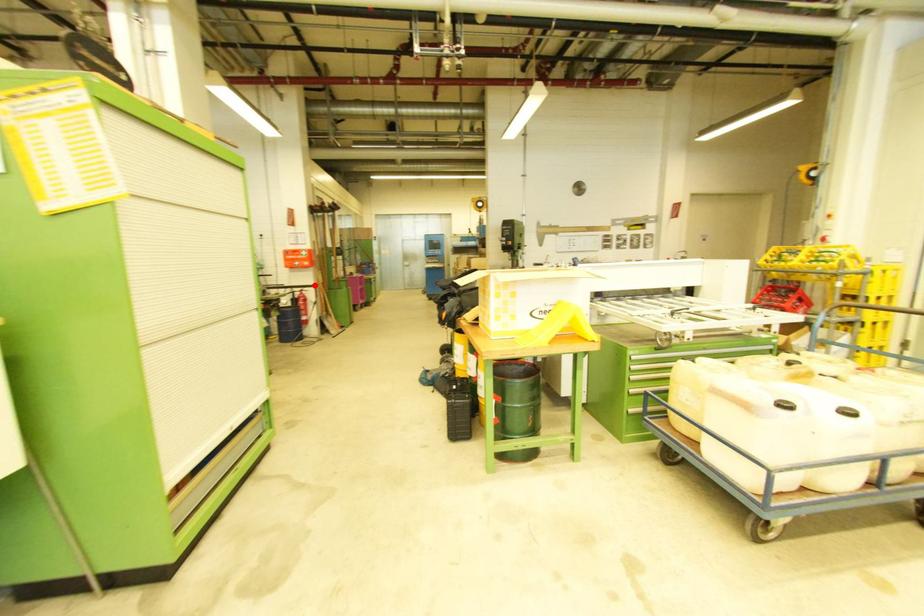
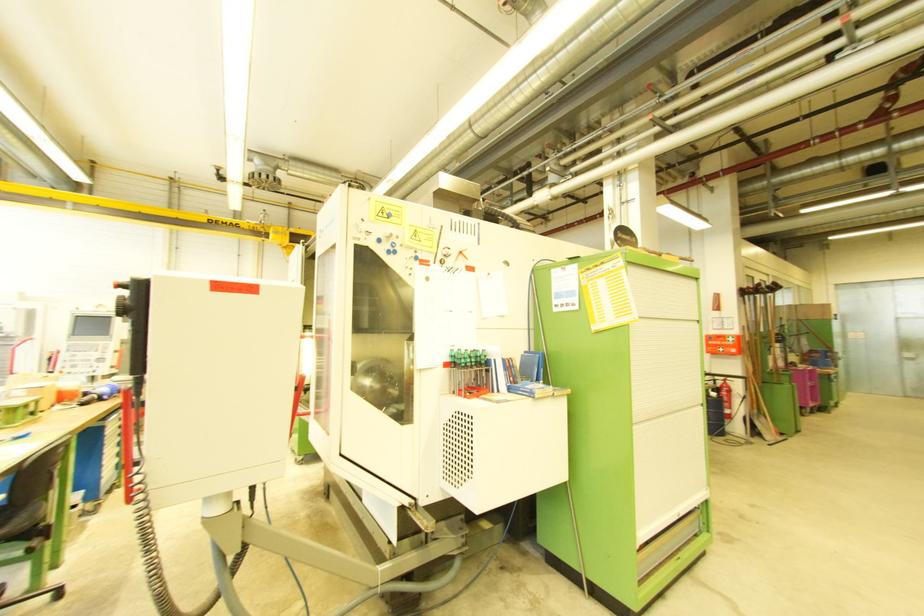
Question: I am providing you with two images of the same scene from different viewpoints. A red point is shown in image1. For the corresponding object point in image2, is it positioned nearer or farther from the camera?

Choices:
 (A) Nearer
 (B) Farther

Answer: (B)